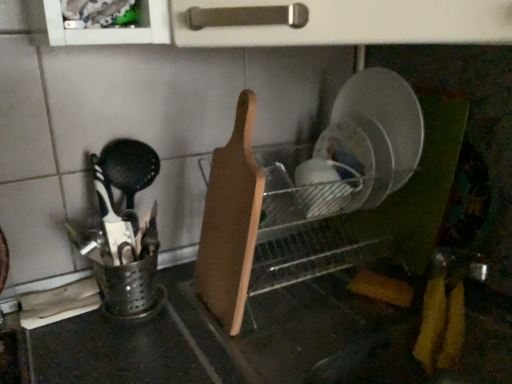
Question: Is wooden cutting board at center taller or shorter than matte white bowl at center?

Choices:
 (A) short
 (B) tall

Answer: (B)

Question: In terms of size, does wooden cutting board at center appear bigger or smaller than matte white bowl at center?

Choices:
 (A) small
 (B) big

Answer: (B)

Question: Based on their positions, is wooden cutting board at center located to the left or right of matte white bowl at center?

Choices:
 (A) right
 (B) left

Answer: (B)

Question: Do you think matte white bowl at center is within wooden cutting board at center, or outside of it?

Choices:
 (A) inside
 (B) outside

Answer: (B)

Question: Looking at their shapes, would you say matte white bowl at center is wider or thinner than wooden cutting board at center?

Choices:
 (A) wide
 (B) thin

Answer: (B)

Question: Based on their positions, is matte white bowl at center located to the left or right of wooden cutting board at center?

Choices:
 (A) right
 (B) left

Answer: (A)

Question: From a real-world perspective, is matte white bowl at center physically located above or below wooden cutting board at center?

Choices:
 (A) below
 (B) above

Answer: (A)